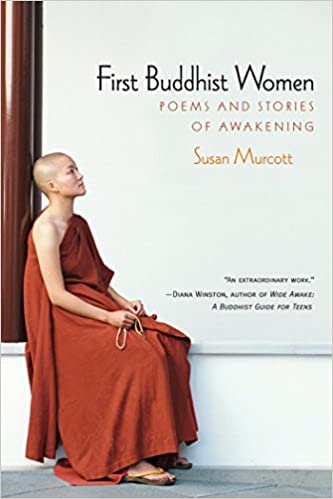
At what (x,y) coordinates should I click in order to perform the action: click on short white wooden wall. Please return your answer as a coordinate pair (x, y). This screenshot has height=499, width=333. Looking at the image, I should click on (247, 378), (224, 347).